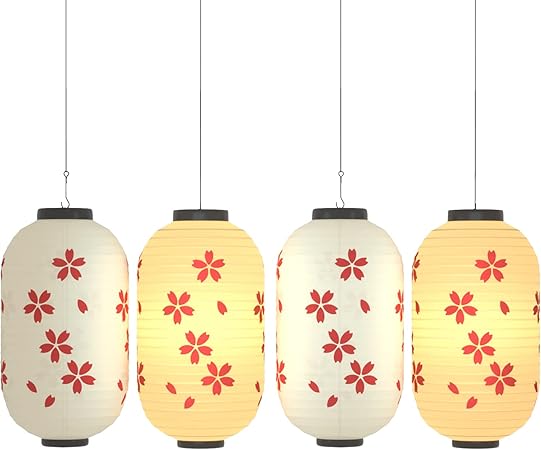
Find the location of `top of lantern`. top of lantern is located at coordinates (74, 208), (199, 209), (343, 209), (480, 210).